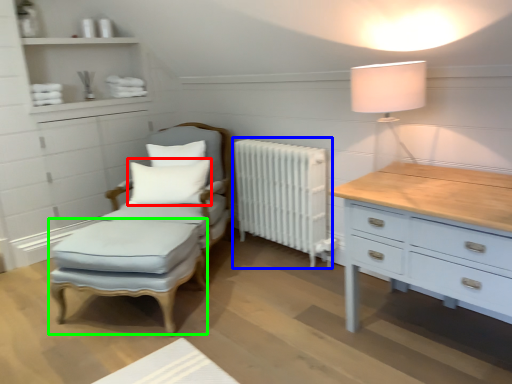
Question: Which is nearer to the pillow (highlighted by a red box)? radiator (highlighted by a blue box) or footrest (highlighted by a green box).

Choices:
 (A) radiator
 (B) footrest

Answer: (B)